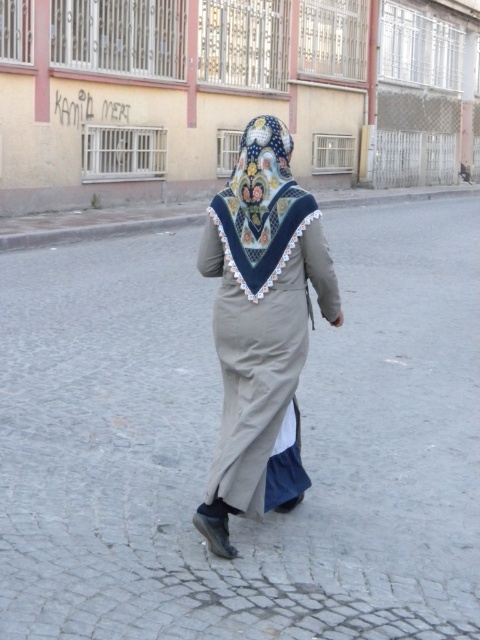
The height and width of the screenshot is (640, 480). In order to click on beige cotton robe at center in this screenshot , I will do `click(264, 369)`.

How much distance is there between beige cotton robe at center and embroidered silk headscarf at center?

beige cotton robe at center and embroidered silk headscarf at center are 23.24 inches apart.

Does point (277, 378) come farther from viewer compared to point (286, 157)?

No.

Where is `beige cotton robe at center`? beige cotton robe at center is located at coordinates (264, 369).